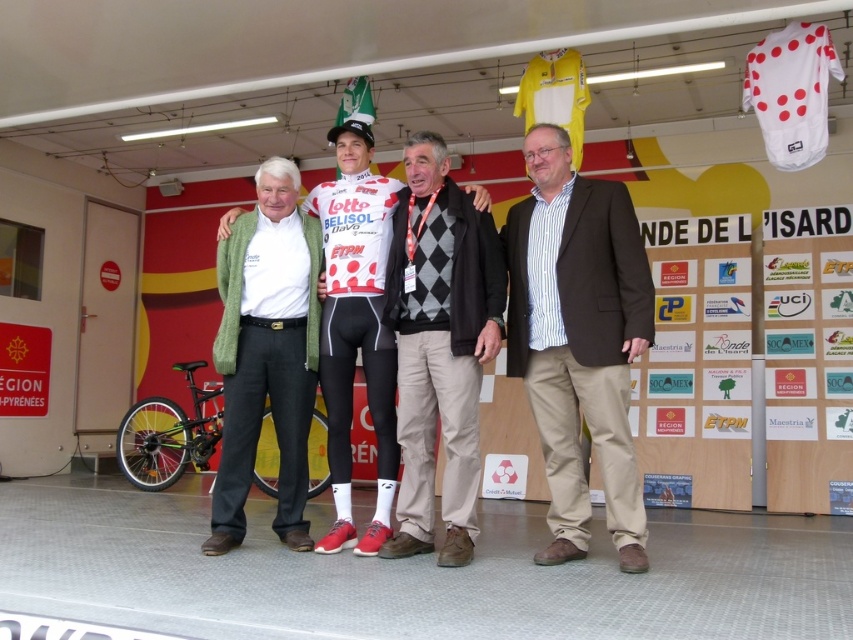
Question: Which of the following is the farthest from the observer?

Choices:
 (A) white jersey at center
 (B) brown textured blazer at center
 (C) green wool sweater at left
 (D) shiny black bicycle at lower left

Answer: (D)

Question: Is white jersey at center to the right of shiny black bicycle at lower left from the viewer's perspective?

Choices:
 (A) yes
 (B) no

Answer: (A)

Question: Does green wool sweater at left have a greater width compared to white jersey at center?

Choices:
 (A) no
 (B) yes

Answer: (A)

Question: Which object appears farthest from the camera in this image?

Choices:
 (A) green wool sweater at left
 (B) brown textured blazer at center
 (C) shiny black bicycle at lower left

Answer: (C)

Question: Which of these objects is positioned closest to the brown textured blazer at center?

Choices:
 (A) shiny black bicycle at lower left
 (B) green wool sweater at left

Answer: (B)

Question: Does brown textured blazer at center appear under white jersey at center?

Choices:
 (A) no
 (B) yes

Answer: (B)